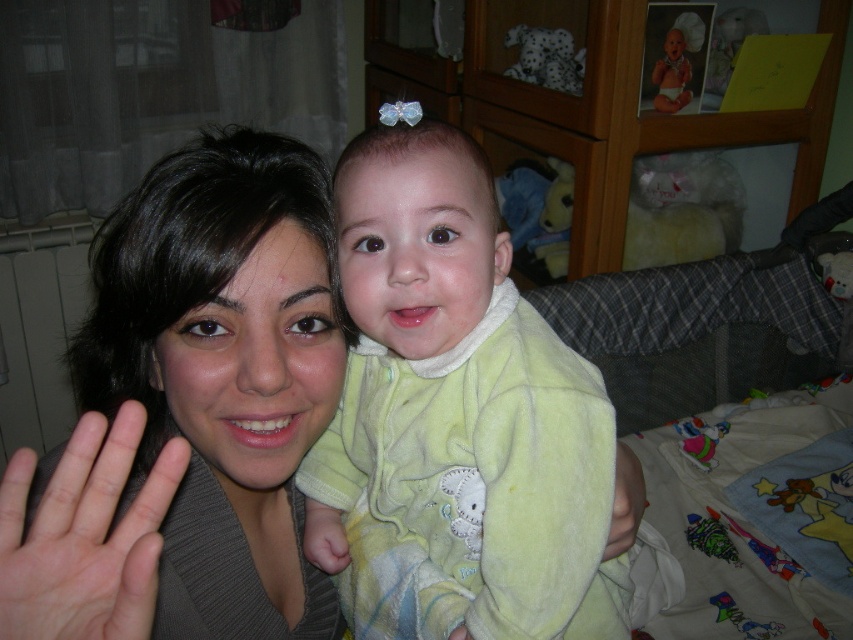
Which is above, light green fleece onesie at center or matte gray sweater at center?

matte gray sweater at center is above.

Between point (573, 566) and point (144, 400), which one is positioned in front?

Point (573, 566) is in front.

At what (x,y) coordinates should I click in order to perform the action: click on light green fleece onesie at center. Please return your answer as a coordinate pair (x, y). Looking at the image, I should click on (459, 396).

Can you confirm if matte gray sweater at center is bigger than pale skin/soft flesh at center?

Correct, matte gray sweater at center is larger in size than pale skin/soft flesh at center.

Between matte gray sweater at center and pale skin/soft flesh at center, which one has less height?

pale skin/soft flesh at center is shorter.

Measure the distance between point (x=296, y=561) and camera.

Point (x=296, y=561) is 77.32 centimeters away from camera.

Locate an element on the screen. Image resolution: width=853 pixels, height=640 pixels. matte gray sweater at center is located at coordinates (223, 372).

Does light green fleece onesie at center have a lesser width compared to pale skin/soft flesh at center?

No.

Is point (383, 499) closer to viewer compared to point (143, 531)?

No.

Locate an element on the screen. The height and width of the screenshot is (640, 853). light green fleece onesie at center is located at coordinates (459, 396).